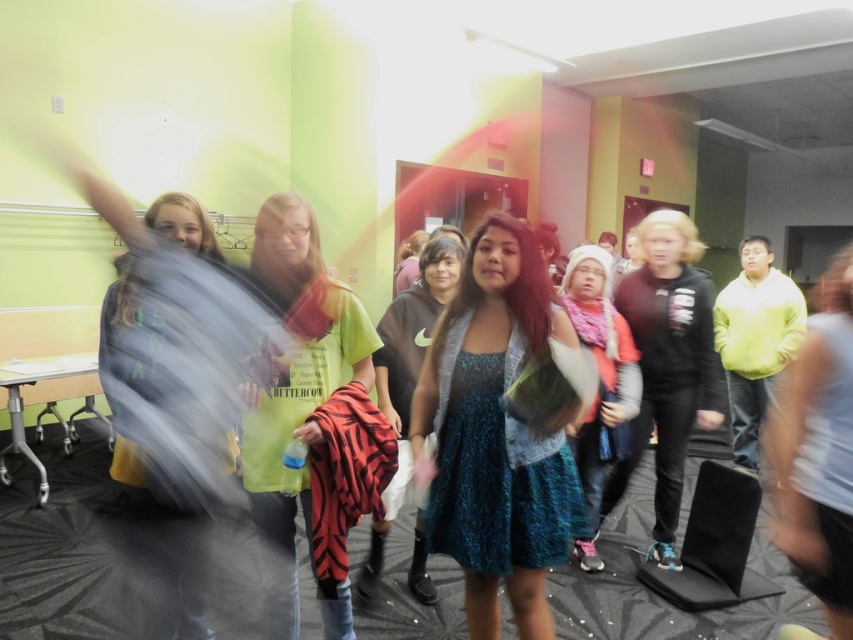
Question: In this image, where is blue sequined dress at center located relative to knitted pink scarf at center?

Choices:
 (A) left
 (B) right

Answer: (A)

Question: Which point appears closest to the camera in this image?

Choices:
 (A) (543, 273)
 (B) (434, 252)
 (C) (343, 307)

Answer: (A)

Question: Does teal printed dress at center lie behind knitted pink scarf at center?

Choices:
 (A) no
 (B) yes

Answer: (A)

Question: Which of the following is the farthest from the observer?

Choices:
 (A) (315, 499)
 (B) (463, 332)

Answer: (B)

Question: Estimate the real-world distances between objects in this image. Which object is farther from the yellow-green t-shirt at center?

Choices:
 (A) knitted pink scarf at center
 (B) blue sequined dress at center

Answer: (A)

Question: In this image, where is teal printed dress at center located relative to blue sequined dress at center?

Choices:
 (A) above
 (B) below

Answer: (A)